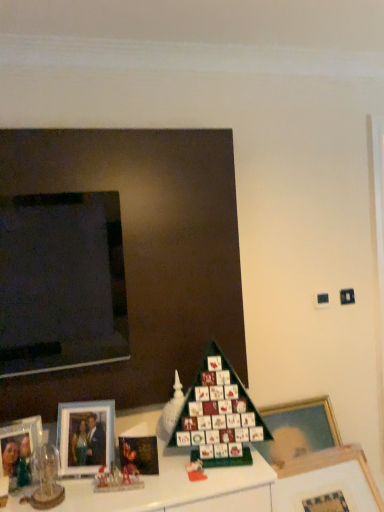
Where is `free spot in front of matte plastic toy at lower center`? free spot in front of matte plastic toy at lower center is located at coordinates (191, 488).